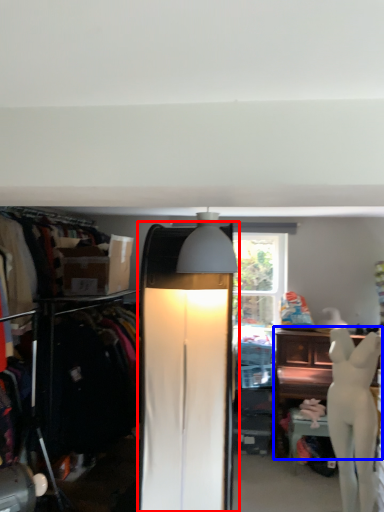
Question: Among these objects, which one is farthest to the camera, lamp (highlighted by a red box) or furniture (highlighted by a blue box)?

Choices:
 (A) lamp
 (B) furniture

Answer: (B)